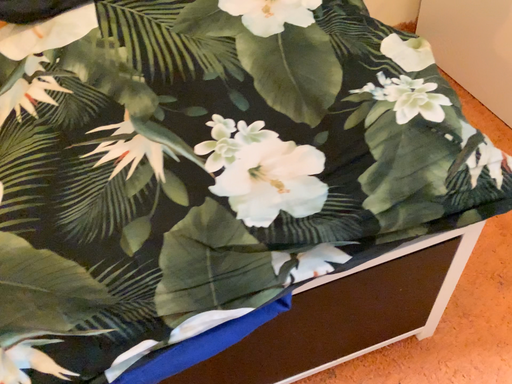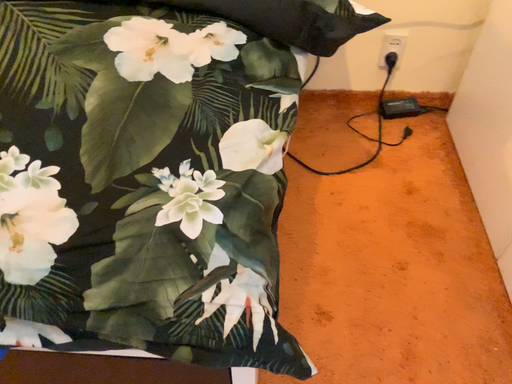
Question: How did the camera likely rotate when shooting the video?

Choices:
 (A) rotated right
 (B) rotated left

Answer: (B)